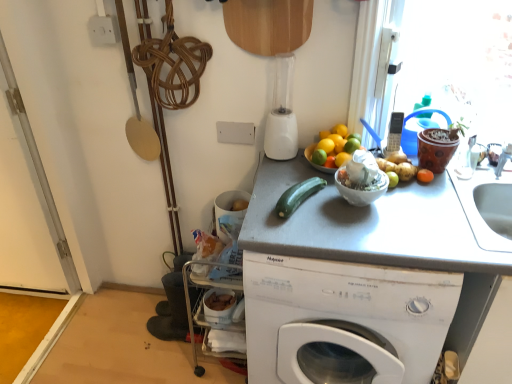
Locate an element on the screen. free space to the left of orange matte at upper right, the 2th orange viewed from the top is located at coordinates (292, 171).